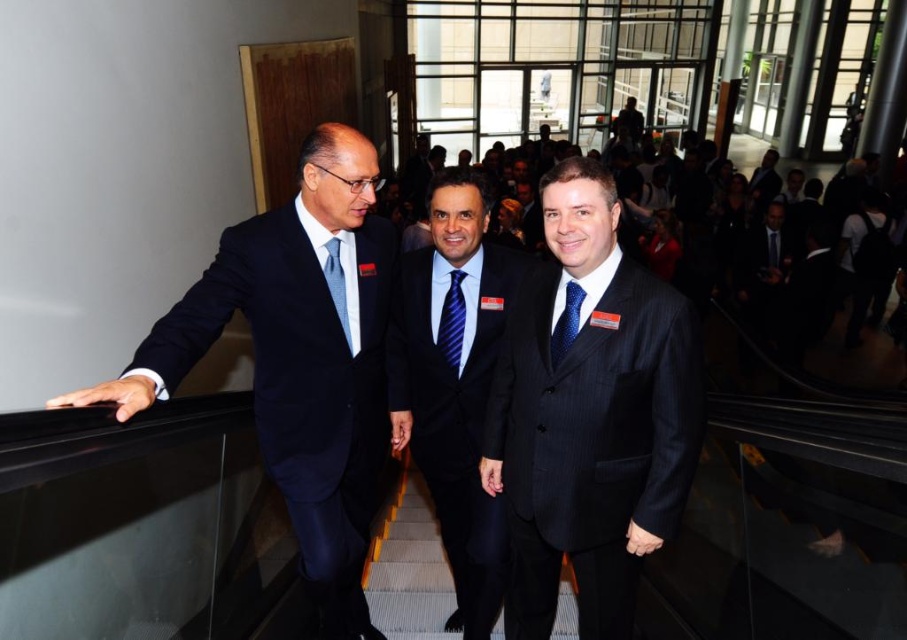
You are a photographer trying to capture a clear shot of the blue striped tie at center and the dark blue suit at upper right. Since you want both objects in focus, which one should you adjust your camera focus to prioritize first?

The blue striped tie at center is closer to the viewer than the dark blue suit at upper right. To ensure both are in focus, prioritize focusing on the blue striped tie at center first, as it is closer, and the depth of field will naturally include the dark blue suit at upper right in the background.

You are a photographer at a professional event. You need to capture a photo of the dark blue pinstripe suit at center and the light blue silk tie at left. Which one should you focus on first if you want to highlight the larger object?

The dark blue pinstripe suit at center is larger in size than the light blue silk tie at left, so you should focus on the dark blue pinstripe suit at center first to highlight its larger size.

Please provide the coordinates of the dark pinstripe suit at center in the image. The coordinates should be in the format of a point with two decimal places separated by a comma. The coordinate system is based on the image with the top left corner as the origin point.

The coordinates of the dark pinstripe suit at center are at point (590,417).